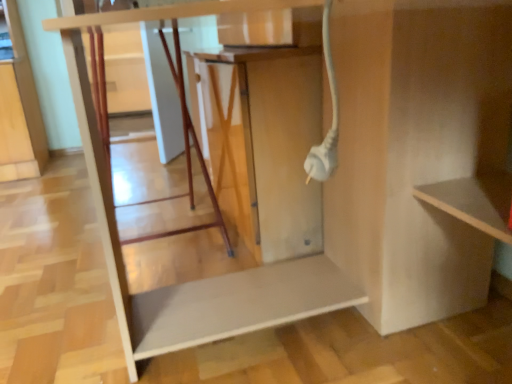
I want to click on vacant area situated to the left side of white matte plug at center, so click(x=70, y=236).